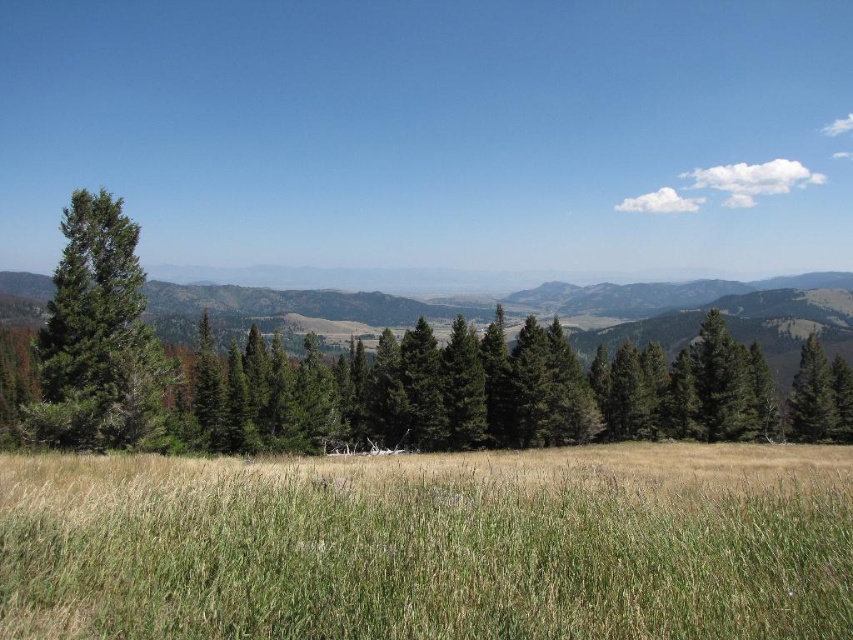
You are standing at the origin point in the image. Where is the green grassy field at center located in terms of 2D coordinates?

The green grassy field at center is located at the 2D coordinates of point (431, 545).

You are standing in the landscape and want to walk towards the green matte tree at left. Which direction should you move relative to the green grassy field at center?

To reach the green matte tree at left, you should move towards the left side of the green grassy field at center since the tree is positioned to the left of the field and is further away from the viewer compared to the field.